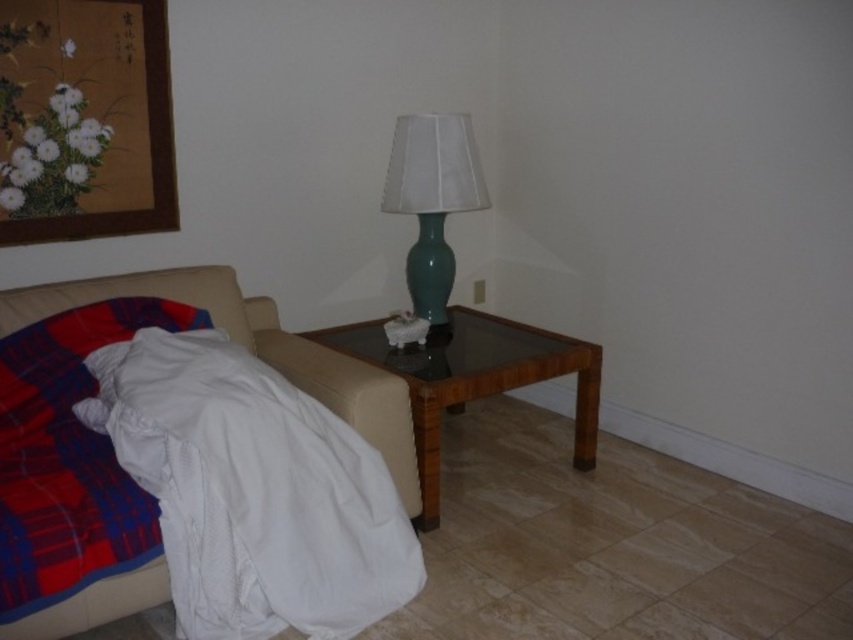
Question: Which object is the farthest from the teal glass lamp at center?

Choices:
 (A) wooden framed artwork at upper left
 (B) white textured blanket at lower left
 (C) white soft pillow at lower left
 (D) woodenside table at center

Answer: (B)

Question: Considering the relative positions of white textured blanket at lower left and teal glass lamp at center in the image provided, where is white textured blanket at lower left located with respect to teal glass lamp at center?

Choices:
 (A) left
 (B) right

Answer: (A)

Question: Estimate the real-world distances between objects in this image. Which object is farther from the wooden framed artwork at upper left?

Choices:
 (A) woodenside table at center
 (B) white soft pillow at lower left
 (C) plaid fabric blanket at lower left

Answer: (A)

Question: Does white textured blanket at lower left have a smaller size compared to teal glass lamp at center?

Choices:
 (A) no
 (B) yes

Answer: (A)

Question: Does wooden framed artwork at upper left have a larger size compared to plaid fabric blanket at lower left?

Choices:
 (A) no
 (B) yes

Answer: (A)

Question: Considering the real-world distances, which object is farthest from the white textured blanket at lower left?

Choices:
 (A) wooden framed artwork at upper left
 (B) woodenside table at center
 (C) plaid fabric blanket at lower left
 (D) white soft pillow at lower left

Answer: (A)